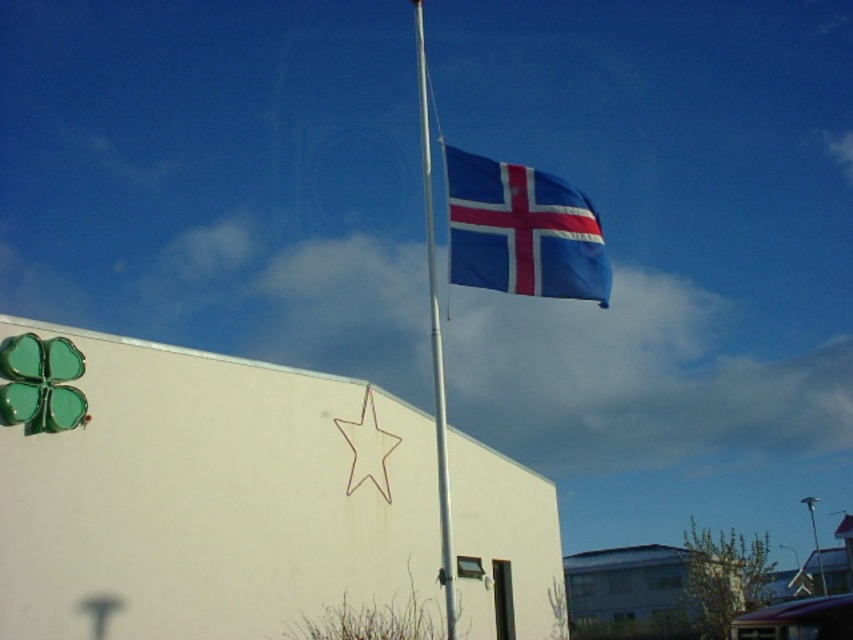
Question: Can you confirm if blue fabric flag at upper center is positioned to the right of silver metallic flag pole at center?

Choices:
 (A) no
 (B) yes

Answer: (B)

Question: Among these objects, which one is nearest to the camera?

Choices:
 (A) blue fabric flag at upper center
 (B) silver metallic flag pole at center
 (C) purple fabric at lower right

Answer: (C)

Question: Can you confirm if blue fabric flag at upper center is smaller than silver metallic flag pole at center?

Choices:
 (A) yes
 (B) no

Answer: (A)

Question: Which point is closer to the camera taking this photo?

Choices:
 (A) (785, 605)
 (B) (526, 276)
 (C) (450, 580)

Answer: (C)

Question: Is blue fabric flag at upper center positioned at the back of purple fabric at lower right?

Choices:
 (A) yes
 (B) no

Answer: (A)

Question: Among these points, which one is nearest to the camera?

Choices:
 (A) (x=502, y=266)
 (B) (x=445, y=442)

Answer: (B)